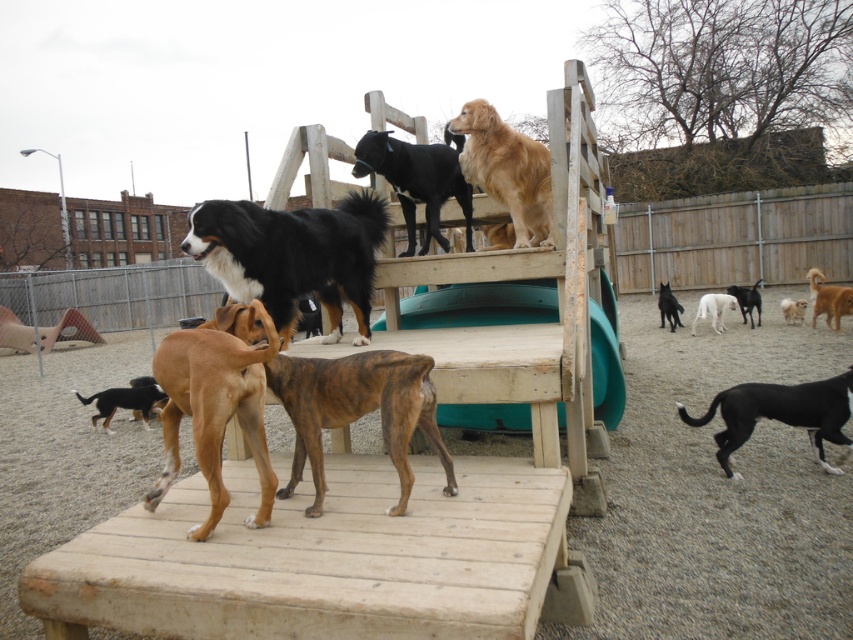
You are standing at the entrance of the dog park and see the brown brindle dog at center. If you want to throw a ball to the dog, and your throwing range is 2 meters, will you be able to reach it?

The distance between you and the brown brindle dog at center is 2.21 meters, which exceeds your throwing range of 2 meters. Therefore, you won

You are a dog owner who wants to bring your new puppy to the park. You see the wooden ramp at center and the black smooth dog at lower right. Which one is larger in size?

The wooden ramp at center is bigger than the black smooth dog at lower right.